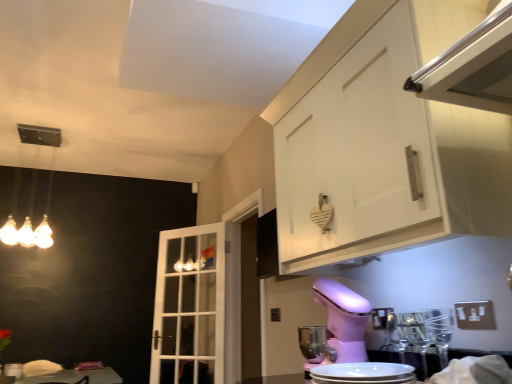
Question: From a real-world perspective, is white matte cabinet at upper right on pink plastic stand mixer at lower center?

Choices:
 (A) no
 (B) yes

Answer: (B)

Question: Is white matte cabinet at upper right far away from pink plastic stand mixer at lower center?

Choices:
 (A) yes
 (B) no

Answer: (B)

Question: Is white matte cabinet at upper right further to camera compared to pink plastic stand mixer at lower center?

Choices:
 (A) yes
 (B) no

Answer: (B)

Question: Is white matte cabinet at upper right facing towards pink plastic stand mixer at lower center?

Choices:
 (A) no
 (B) yes

Answer: (A)

Question: Is white matte cabinet at upper right turned away from pink plastic stand mixer at lower center?

Choices:
 (A) yes
 (B) no

Answer: (B)

Question: Considering the relative sizes of white matte cabinet at upper right and pink plastic stand mixer at lower center in the image provided, is white matte cabinet at upper right taller than pink plastic stand mixer at lower center?

Choices:
 (A) no
 (B) yes

Answer: (B)

Question: From a real-world perspective, is pink plastic mixer at lower center located beneath white matte cabinet at upper right?

Choices:
 (A) yes
 (B) no

Answer: (A)

Question: Can you confirm if pink plastic mixer at lower center is positioned to the right of white matte cabinet at upper right?

Choices:
 (A) yes
 (B) no

Answer: (B)

Question: From the image's perspective, is pink plastic mixer at lower center beneath white matte cabinet at upper right?

Choices:
 (A) yes
 (B) no

Answer: (A)

Question: Does pink plastic mixer at lower center have a greater width compared to white matte cabinet at upper right?

Choices:
 (A) yes
 (B) no

Answer: (A)

Question: Is pink plastic mixer at lower center outside white matte cabinet at upper right?

Choices:
 (A) no
 (B) yes

Answer: (B)

Question: Is pink plastic mixer at lower center positioned behind white matte cabinet at upper right?

Choices:
 (A) yes
 (B) no

Answer: (A)

Question: From the image's perspective, is white matte cabinet at upper right located above matte glass light fixture at upper left?

Choices:
 (A) no
 (B) yes

Answer: (B)